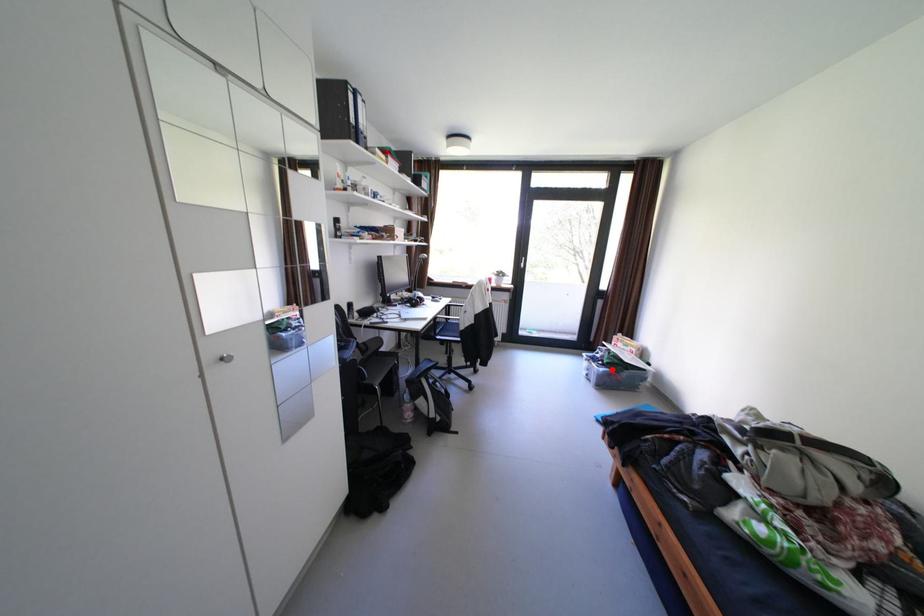
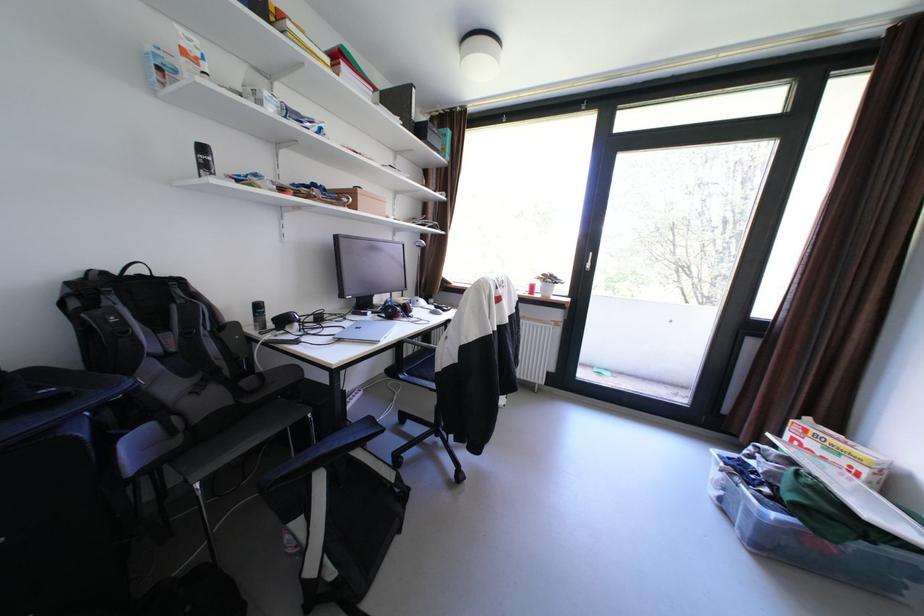
Locate, in the second image, the point that corresponds to the highlighted location in the first image.

(784, 516)